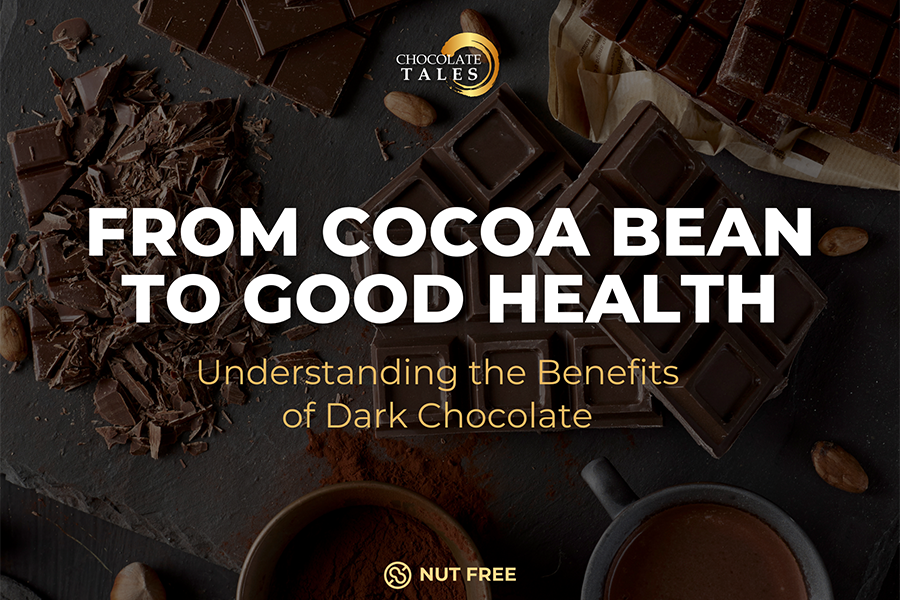
The image size is (900, 600). What are the coordinates of `mug` in the screenshot? It's located at (608, 549).